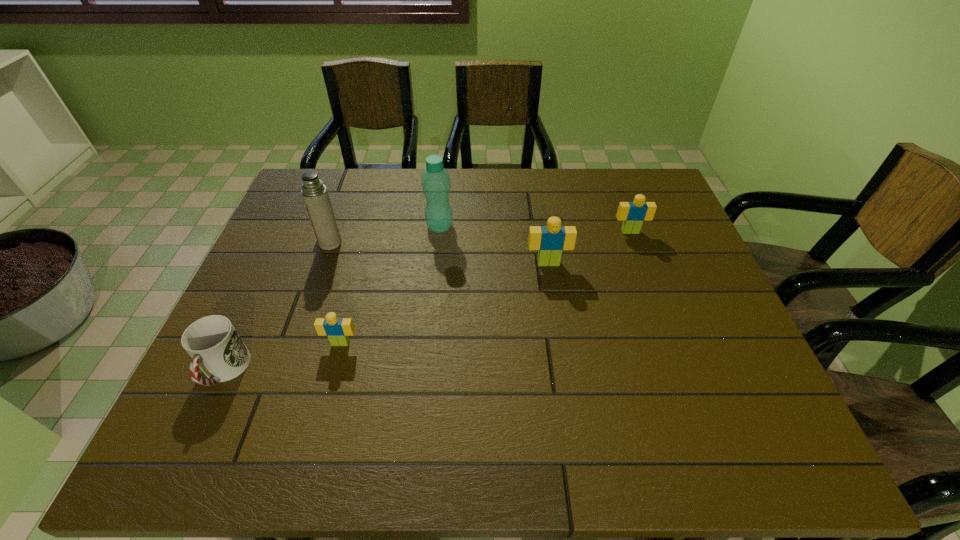
Identify the location of vacant space that's between the second object from left to right and the leftmost object. (277, 307).

The width and height of the screenshot is (960, 540). What are the coordinates of `free space between the thermos bottle and the second farthest Lego` in the screenshot? It's located at [x=440, y=253].

Identify the location of empty location between the second object from left to right and the farthest Lego. The width and height of the screenshot is (960, 540). (480, 237).

This screenshot has width=960, height=540. Find the location of `empty space between the fourth shortest object and the second object from left to right`. empty space between the fourth shortest object and the second object from left to right is located at coordinates (440, 253).

The height and width of the screenshot is (540, 960). Find the location of `free space between the third object from right to left and the second object from left to right`. free space between the third object from right to left and the second object from left to right is located at coordinates (385, 234).

Where is `the third closest object to the fifth object from right to left`? the third closest object to the fifth object from right to left is located at coordinates (214, 345).

Identify the location of object that is the closest to the second object from right to left. (632, 214).

In order to click on Lego identified as the second closest to the fourth object from left to right in this screenshot , I will do `click(338, 330)`.

The image size is (960, 540). I want to click on Lego identified as the closest to the nearest Lego, so click(550, 240).